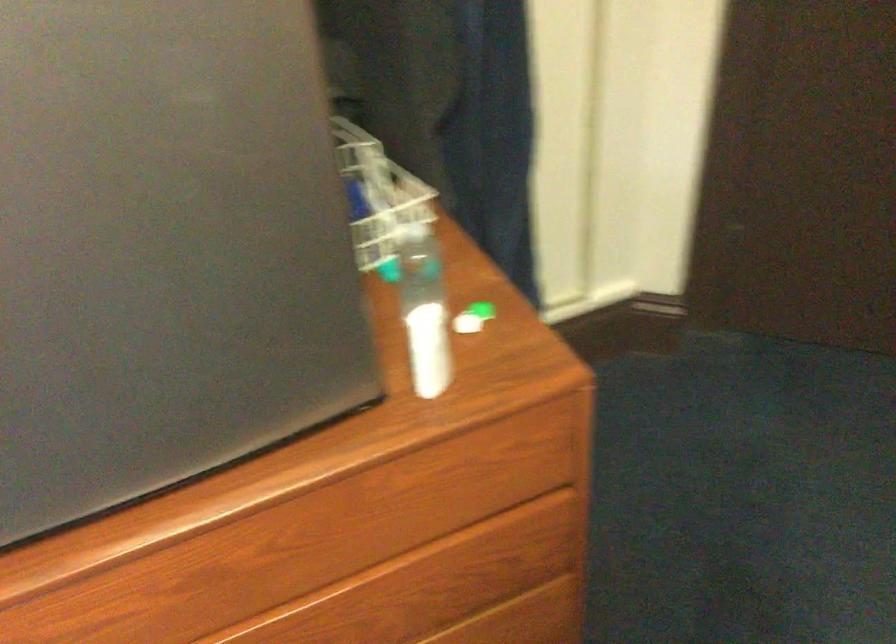
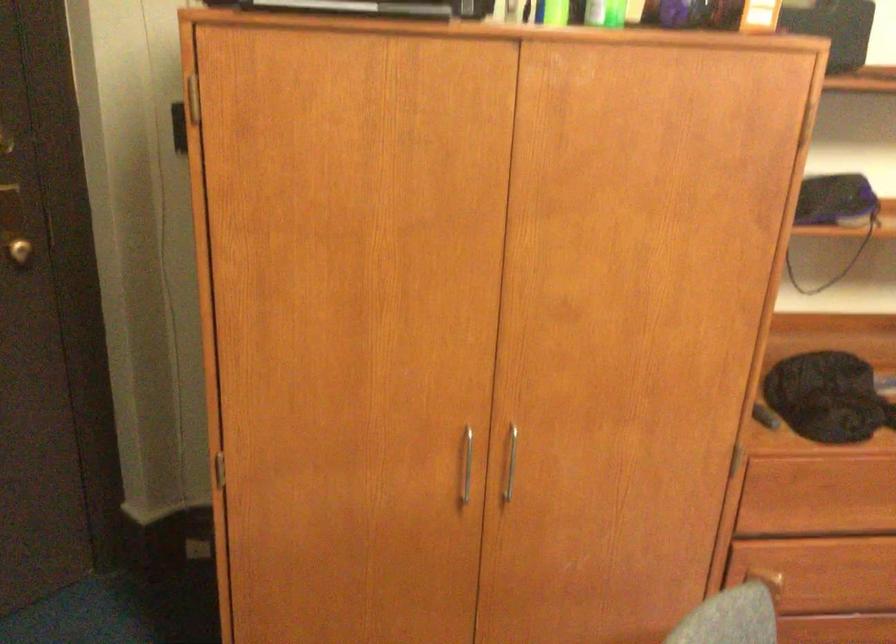
Question: The camera is either moving clockwise (left) or counter-clockwise (right) around the object. The first image is from the beginning of the video and the second image is from the end. Is the camera moving left or right when shooting the video?

Choices:
 (A) Left
 (B) Right

Answer: (A)